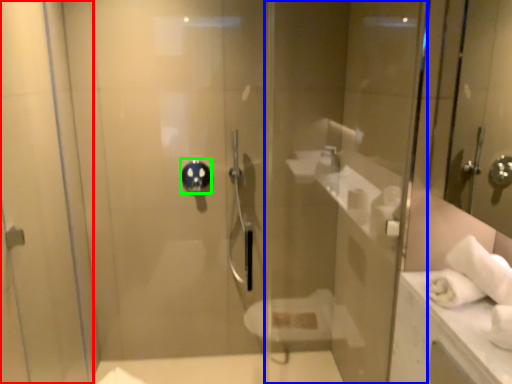
Question: Estimate the real-world distances between objects in this image. Which object is farther from screen door (highlighted by a red box), glass door (highlighted by a blue box) or shower (highlighted by a green box)?

Choices:
 (A) glass door
 (B) shower

Answer: (A)